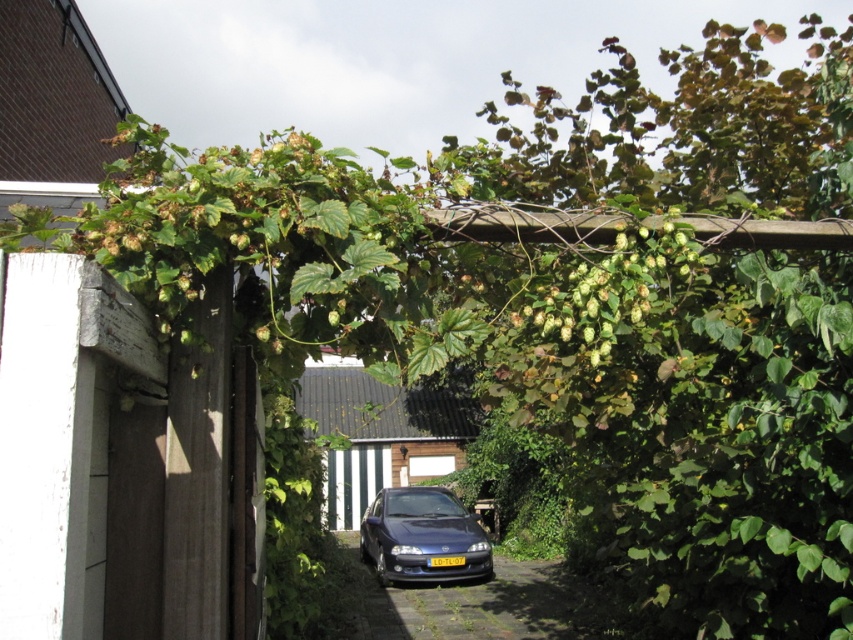
Is black asphalt driveway at center bigger than shiny dark blue sedan at center?

No.

Who is more forward, (482, 596) or (440, 515)?

Point (482, 596) is more forward.

Does point (418, 602) come in front of point (370, 513)?

Yes, point (418, 602) is in front of point (370, 513).

The image size is (853, 640). What are the coordinates of `black asphalt driveway at center` in the screenshot? It's located at pyautogui.click(x=479, y=604).